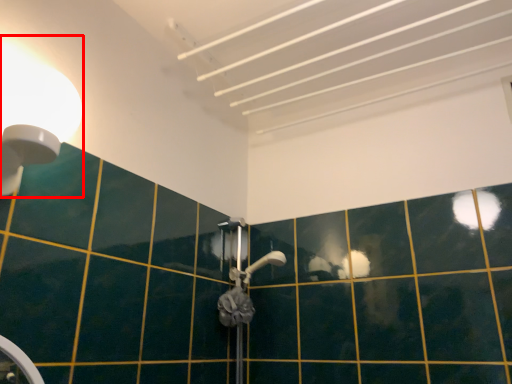
Question: Considering the relative positions of light fixture (annotated by the red box) and shower in the image provided, where is light fixture (annotated by the red box) located with respect to the staircase?

Choices:
 (A) right
 (B) left

Answer: (B)